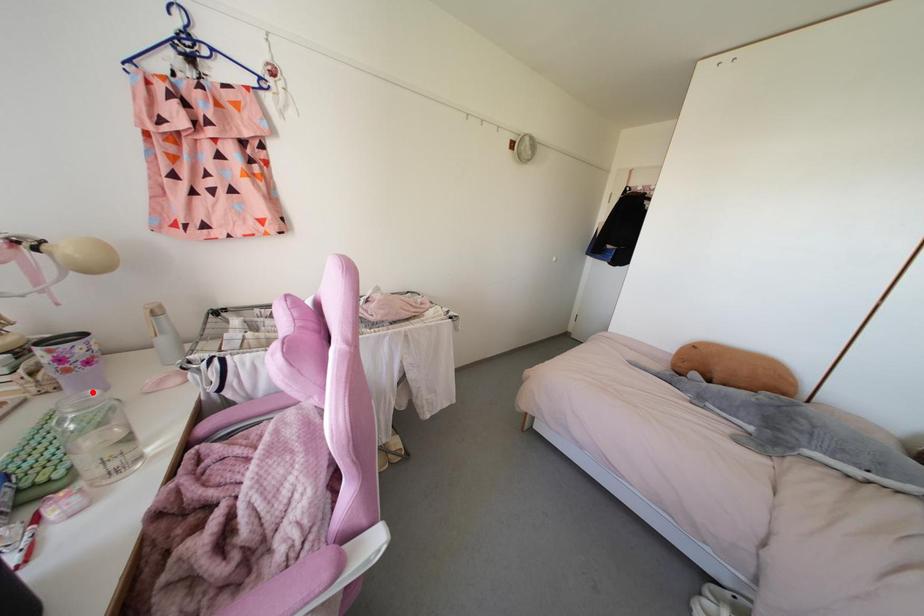
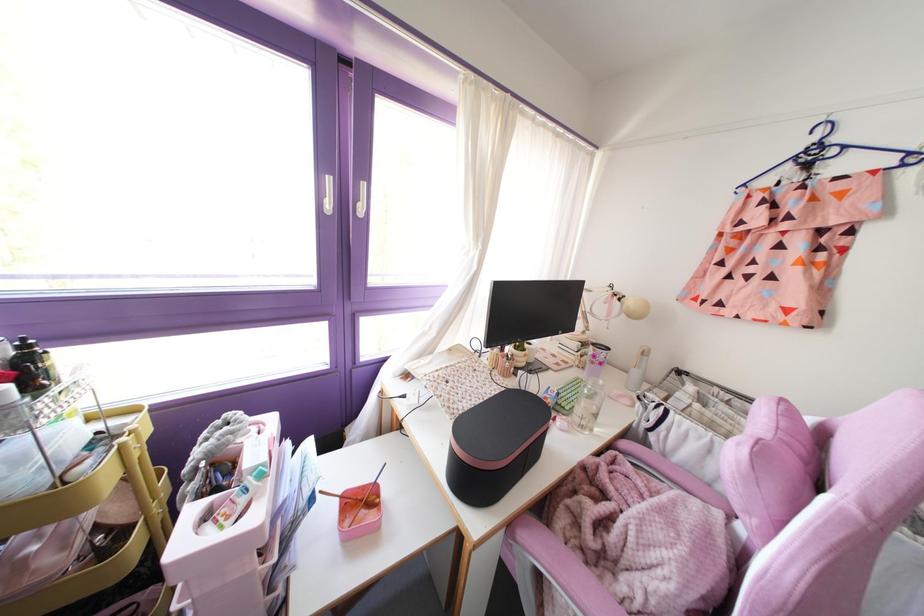
Question: I am providing you with two images of the same scene from different viewpoints. A red point is marked on the first image. Can you still see the location of the red point in image 2?

Choices:
 (A) Yes
 (B) No

Answer: (A)